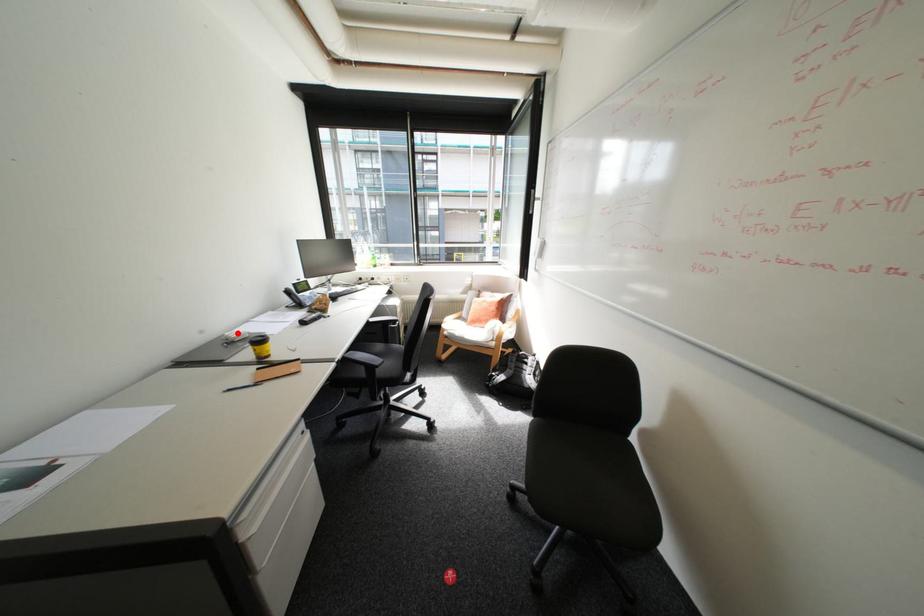
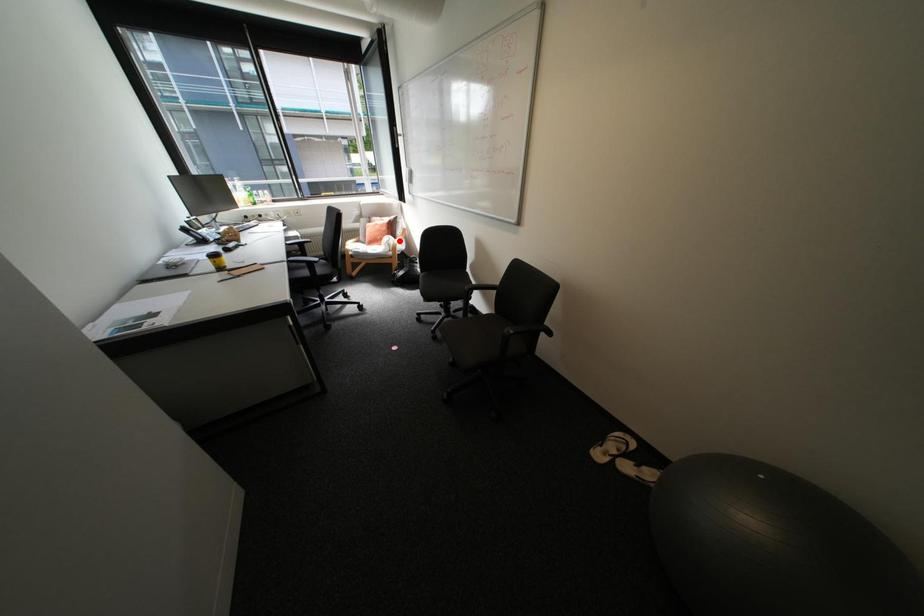
I am providing you with two images of the same scene from different viewpoints. A red point is marked on the first image and another point is marked on the second image. Is the marked point in image1 the same physical position as the marked point in image2?

No